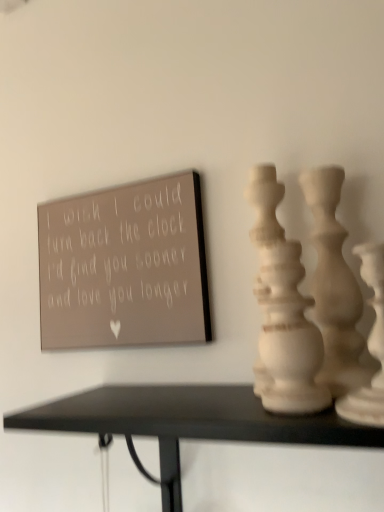
Question: Is white matte vase at center, arranged as the second vase when viewed from the front, aimed at white matte vase at right, the first vase when ordered from front to back?

Choices:
 (A) yes
 (B) no

Answer: (B)

Question: From the image's perspective, is white matte vase at center, which is the second vase from back to front, beneath white matte vase at right, acting as the third vase starting from the back?

Choices:
 (A) no
 (B) yes

Answer: (B)

Question: Is white matte vase at center, arranged as the second vase when viewed from the front, next to white matte vase at right, the first vase when ordered from front to back?

Choices:
 (A) no
 (B) yes

Answer: (B)

Question: From a real-world perspective, is white matte vase at center, which is the second vase from back to front, on top of white matte vase at right, the first vase when ordered from front to back?

Choices:
 (A) no
 (B) yes

Answer: (B)

Question: Considering the relative positions of white matte vase at center, which is the second vase from back to front, and white matte vase at right, the first vase when ordered from front to back, in the image provided, is white matte vase at center, which is the second vase from back to front, to the left of white matte vase at right, the first vase when ordered from front to back, from the viewer's perspective?

Choices:
 (A) yes
 (B) no

Answer: (A)

Question: From the image's perspective, is white matte vase at center, which is the second vase from back to front, located above or below matte gray sign at upper left?

Choices:
 (A) above
 (B) below

Answer: (B)

Question: From their relative heights in the image, would you say white matte vase at center, which is the second vase from back to front, is taller or shorter than matte gray sign at upper left?

Choices:
 (A) tall
 (B) short

Answer: (B)

Question: In terms of width, does white matte vase at center, which is the second vase from back to front, look wider or thinner when compared to matte gray sign at upper left?

Choices:
 (A) wide
 (B) thin

Answer: (A)

Question: From a real-world perspective, is white matte vase at center, which is the second vase from back to front, positioned above or below matte gray sign at upper left?

Choices:
 (A) below
 (B) above

Answer: (A)

Question: Is matte gray sign at upper left bigger or smaller than white matte vase at right, acting as the third vase starting from the back?

Choices:
 (A) small
 (B) big

Answer: (B)

Question: Looking at their shapes, would you say matte gray sign at upper left is wider or thinner than white matte vase at right, the first vase when ordered from front to back?

Choices:
 (A) wide
 (B) thin

Answer: (B)

Question: From the image's perspective, is matte gray sign at upper left above or below white matte vase at right, the first vase when ordered from front to back?

Choices:
 (A) below
 (B) above

Answer: (B)

Question: From a real-world perspective, relative to white matte vase at right, the first vase when ordered from front to back, is matte gray sign at upper left vertically above or below?

Choices:
 (A) below
 (B) above

Answer: (B)

Question: Looking at their shapes, would you say white matte vase at right, the first vase when ordered from front to back, is wider or thinner than white matte vase at right, the third vase when ordered from front to back?

Choices:
 (A) thin
 (B) wide

Answer: (B)

Question: Is point (375, 388) positioned closer to the camera than point (334, 181)?

Choices:
 (A) farther
 (B) closer

Answer: (B)